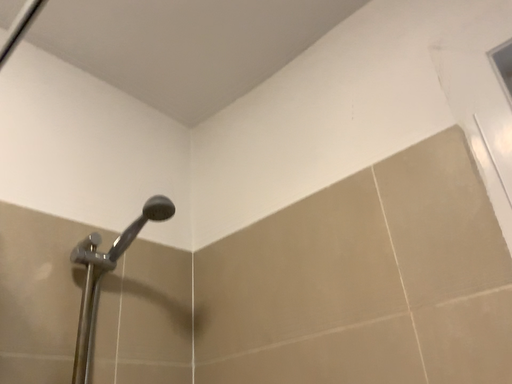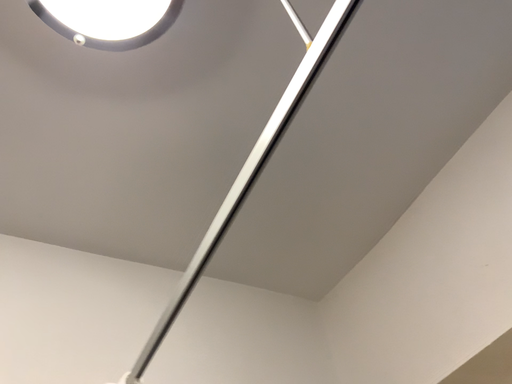
Question: How did the camera likely rotate when shooting the video?

Choices:
 (A) rotated right
 (B) rotated left

Answer: (B)